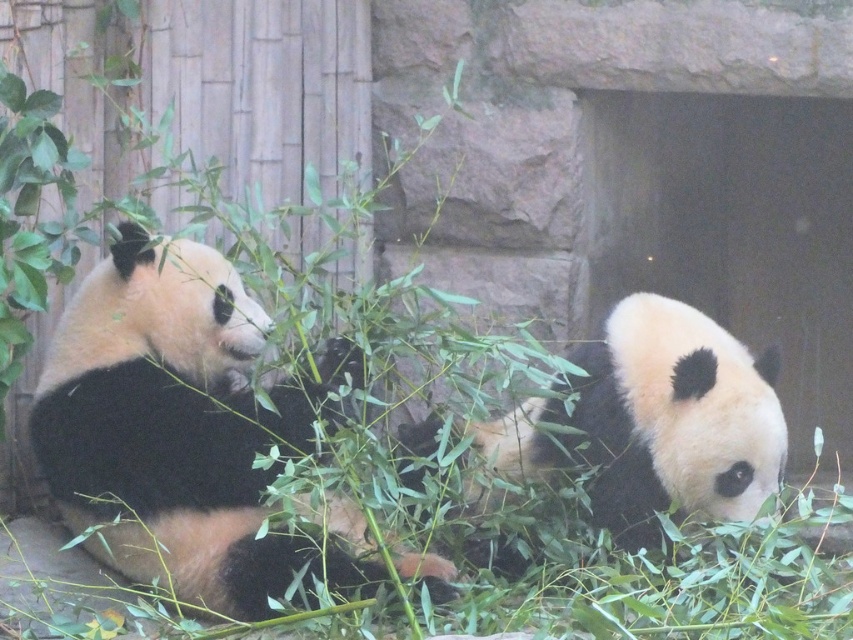
Which is more to the left, black fur panda at center or black fur panda at right?

From the viewer's perspective, black fur panda at center appears more on the left side.

The height and width of the screenshot is (640, 853). Describe the element at coordinates (173, 424) in the screenshot. I see `black fur panda at center` at that location.

Where is `black fur panda at center`? black fur panda at center is located at coordinates (173, 424).